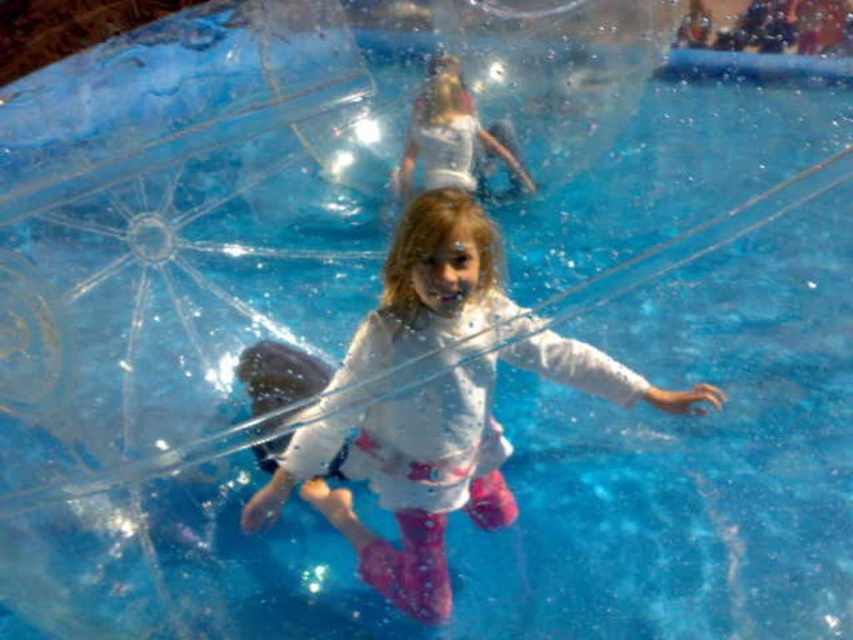
You are a photographer standing in front of the water park scene. You want to take a photo of the child in the inflatable ball. Which of the two shirts, the white matte shirt at center or the white cotton shirt at upper center, will appear larger in your photo?

The white matte shirt at center will appear larger in the photo because it is closer to the viewer than the white cotton shirt at upper center.

You are a photographer standing at the center of the water park. You want to take a photo that includes both point (x=320, y=456) and point (x=438, y=172). Which point should you focus on first to ensure both are in focus?

You should focus on point (x=438, y=172) first because it is closer to you than point (x=320, y=456), which is further away. By focusing on the closer point, the depth of field may help keep both points in focus.